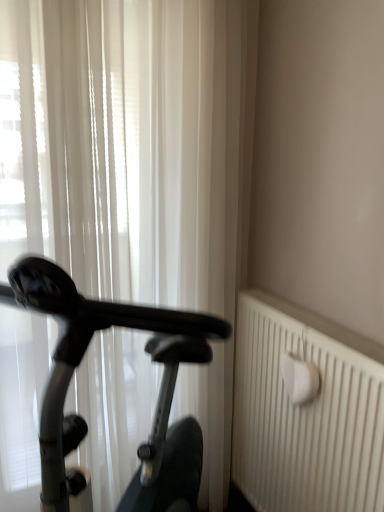
Describe the element at coordinates (158, 396) in the screenshot. This screenshot has height=512, width=384. I see `black glossy exercise bike at left` at that location.

At what (x,y) coordinates should I click in order to perform the action: click on black glossy exercise bike at left. Please return your answer as a coordinate pair (x, y). Looking at the image, I should click on (158, 396).

Where is `white sheer curtain at left`? This screenshot has width=384, height=512. white sheer curtain at left is located at coordinates (130, 144).

You are a GUI agent. You are given a task and a screenshot of the screen. Output one action in this format:
    pyautogui.click(x=<x>, y=<y>)
    Task: Click on the white textured radiator at right
    
    Given the screenshot: What is the action you would take?
    pyautogui.click(x=306, y=413)

Is black glossy exercise bike at left oriented away from white sheer curtain at left?

Yes, black glossy exercise bike at left is positioned with its back facing white sheer curtain at left.

Which object is closer to the camera taking this photo, black glossy exercise bike at left or white sheer curtain at left?

Positioned in front is black glossy exercise bike at left.

Looking at this image, which point is more distant from viewer, [198,459] or [217,492]?

The point [217,492] is farther.

At what (x,y) coordinates should I click in order to perform the action: click on curtain above the black glossy exercise bike at left (from the image's perspective). Please return your answer as a coordinate pair (x, y). The height and width of the screenshot is (512, 384). Looking at the image, I should click on (130, 144).

What are the coordinates of `bicycle below the white sheer curtain at left (from a real-world perspective)` in the screenshot? It's located at (158, 396).

From a real-world perspective, is white sheer curtain at left above or below black glossy exercise bike at left?

Clearly, from a real-world perspective, white sheer curtain at left is above black glossy exercise bike at left.

Does white sheer curtain at left appear on the right side of black glossy exercise bike at left?

Incorrect, white sheer curtain at left is not on the right side of black glossy exercise bike at left.

Would you say white sheer curtain at left is inside or outside black glossy exercise bike at left?

The correct answer is: outside.

Would you say white textured radiator at right is inside or outside white sheer curtain at left?

white textured radiator at right lies outside white sheer curtain at left.

Is white textured radiator at right taller or shorter than white sheer curtain at left?

Clearly, white textured radiator at right is shorter compared to white sheer curtain at left.

Is white textured radiator at right facing away from white sheer curtain at left?

white textured radiator at right is not turned away from white sheer curtain at left.

Is white sheer curtain at left at the right side of white textured radiator at right?

Incorrect, white sheer curtain at left is not on the right side of white textured radiator at right.

Is white sheer curtain at left taller than white textured radiator at right?

Yes, white sheer curtain at left is taller than white textured radiator at right.

Which point is more distant from viewer, [22,245] or [364,420]?

The point [22,245] is farther.

Looking at this image, is white sheer curtain at left bigger than white textured radiator at right?

Yes.

Is point (344, 439) positioned behind point (68, 380)?

Yes, it is.

From the image's perspective, who appears lower, white textured radiator at right or black glossy exercise bike at left?

white textured radiator at right is shown below in the image.

Considering the sizes of white textured radiator at right and black glossy exercise bike at left in the image, is white textured radiator at right wider or thinner than black glossy exercise bike at left?

white textured radiator at right is thinner than black glossy exercise bike at left.

In the scene shown: Is there a large distance between white textured radiator at right and black glossy exercise bike at left?

white textured radiator at right is actually quite close to black glossy exercise bike at left.

Is black glossy exercise bike at left inside or outside of white textured radiator at right?

The correct answer is: outside.

Based on the photo, can you confirm if black glossy exercise bike at left is positioned to the right of white textured radiator at right?

No.

Considering the positions of objects black glossy exercise bike at left and white textured radiator at right in the image provided, who is behind, black glossy exercise bike at left or white textured radiator at right?

white textured radiator at right is more distant.

In order to click on curtain located above the black glossy exercise bike at left (from the image's perspective) in this screenshot , I will do `click(130, 144)`.

I want to click on curtain that appears on the left of black glossy exercise bike at left, so click(x=130, y=144).

From the image, which object appears to be nearer to white sheer curtain at left, white textured radiator at right or black glossy exercise bike at left?

Among the two, black glossy exercise bike at left is located nearer to white sheer curtain at left.

When comparing their distances from white textured radiator at right, does white sheer curtain at left or black glossy exercise bike at left seem further?

The object further to white textured radiator at right is white sheer curtain at left.

Based on the photo, considering their positions, is white sheer curtain at left positioned closer to black glossy exercise bike at left than white textured radiator at right?

Among the two, white textured radiator at right is located nearer to black glossy exercise bike at left.

Based on their spatial positions, is white textured radiator at right or white sheer curtain at left closer to black glossy exercise bike at left?

white textured radiator at right.

When comparing their distances from white sheer curtain at left, does black glossy exercise bike at left or white textured radiator at right seem further?

The object further to white sheer curtain at left is white textured radiator at right.

Based on their spatial positions, is black glossy exercise bike at left or white sheer curtain at left closer to white textured radiator at right?

black glossy exercise bike at left.

I want to click on bicycle between white sheer curtain at left and white textured radiator at right in the horizontal direction, so click(x=158, y=396).